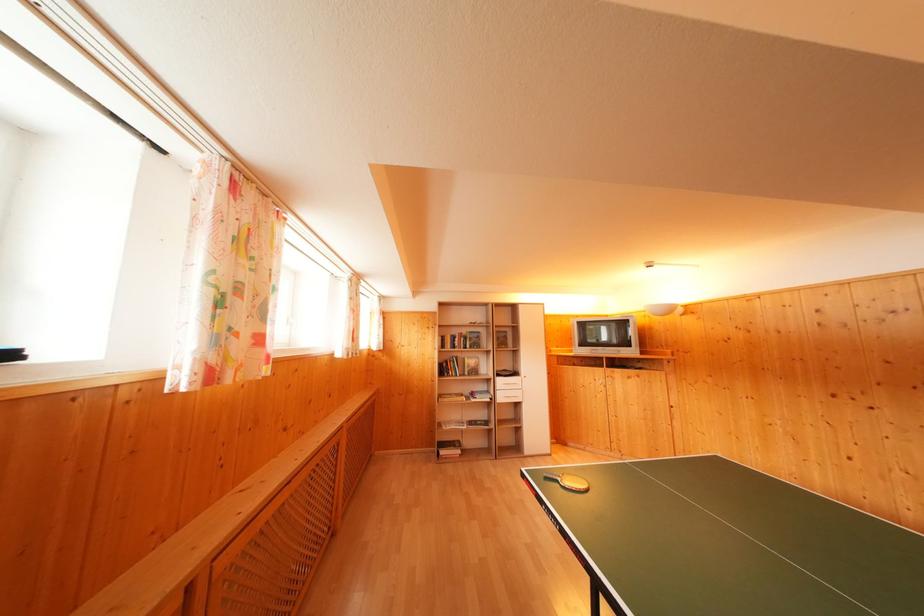
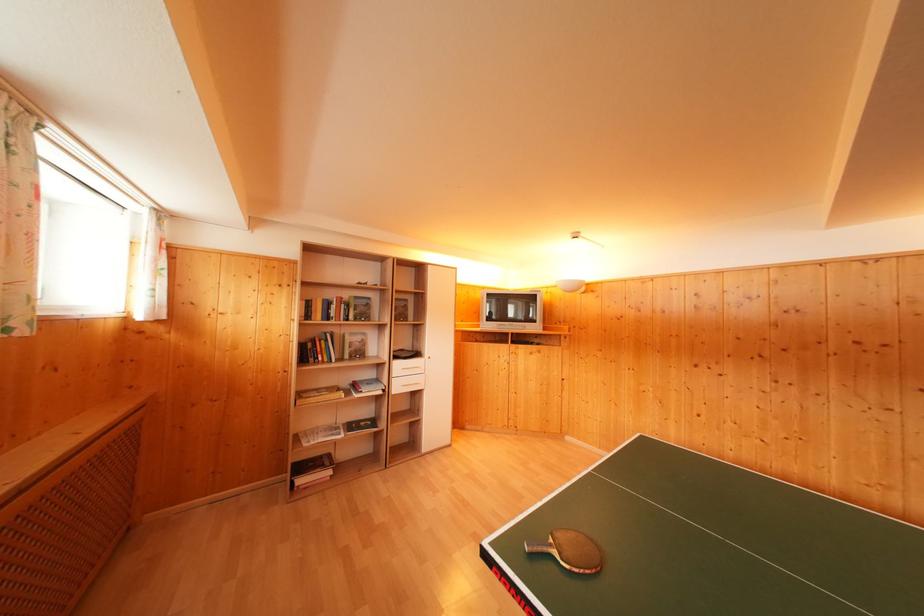
Question: The images are taken continuously from a first-person perspective. In which direction are you moving?

Choices:
 (A) Left
 (B) Right
 (C) Forward
 (D) Backward

Answer: (C)